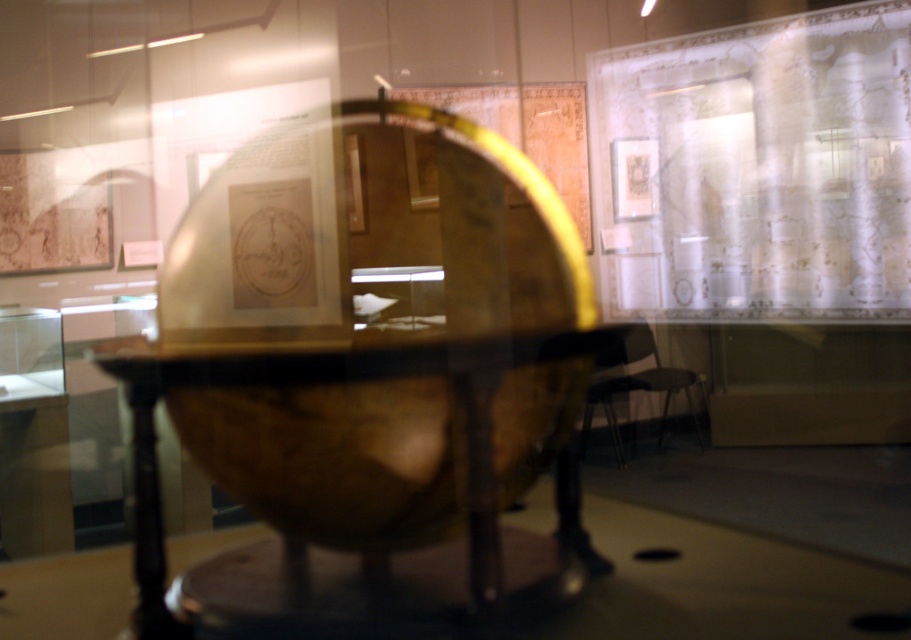
Question: Considering the relative positions of transparent wood globe at center and matte black chair at center in the image provided, where is transparent wood globe at center located with respect to matte black chair at center?

Choices:
 (A) above
 (B) below

Answer: (A)

Question: Is transparent wood globe at center positioned in front of matte black chair at center?

Choices:
 (A) yes
 (B) no

Answer: (A)

Question: Which point appears closest to the camera in this image?

Choices:
 (A) (195, 371)
 (B) (623, 340)

Answer: (A)

Question: Is transparent wood globe at center below matte black chair at center?

Choices:
 (A) yes
 (B) no

Answer: (B)